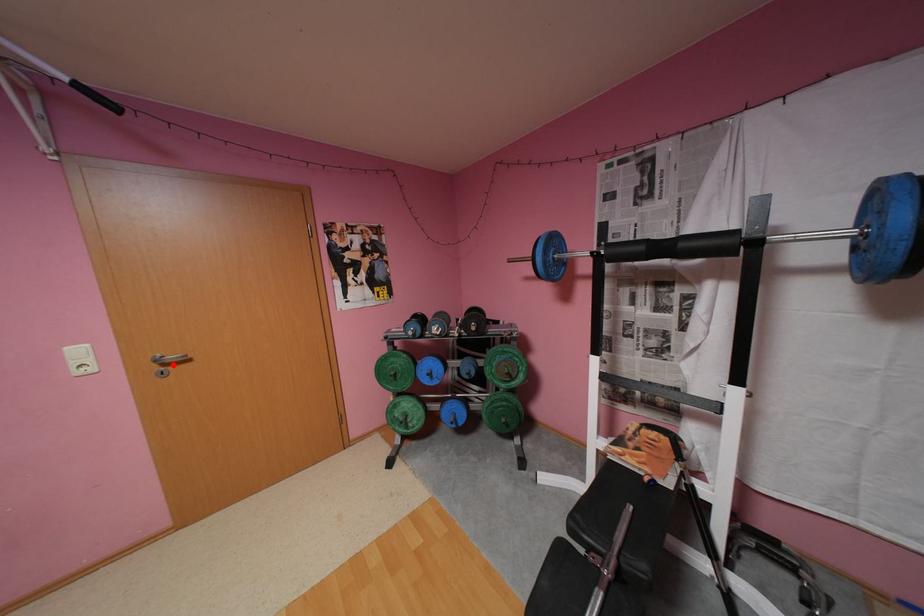
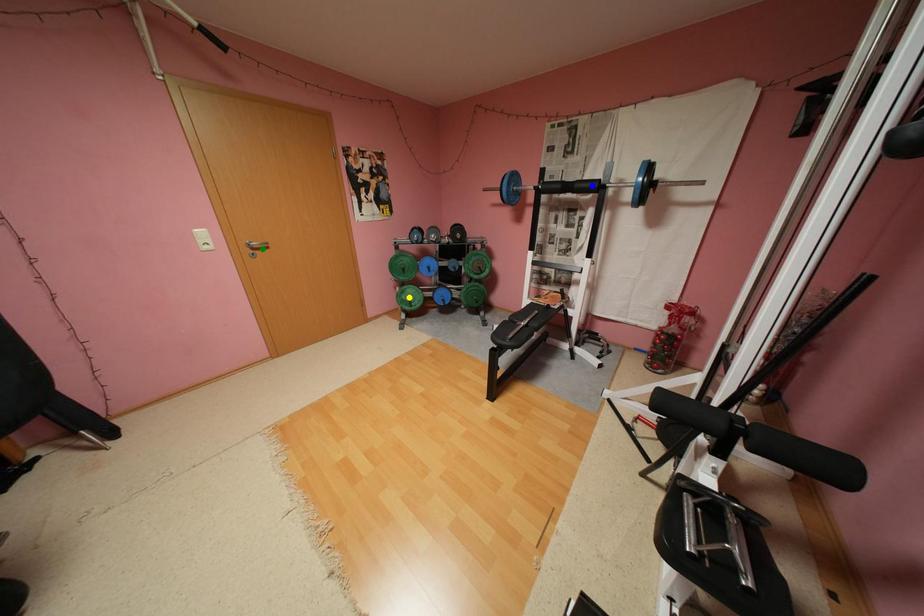
Question: I am providing you with two images of the same scene from different viewpoints. A red point is marked on the first image. You are given multiple points on the second image. Which point in image 2 represents the same 3d spot as the red point in image 1?

Choices:
 (A) blue point
 (B) yellow point
 (C) green point

Answer: (C)